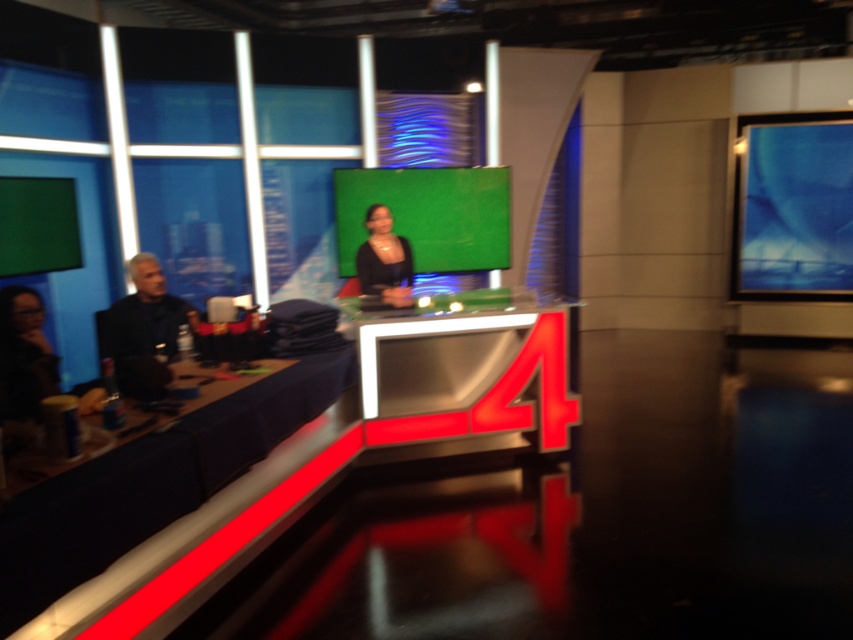
Question: Considering the relative positions of metallic reflective table at center and green matte screen at center in the image provided, where is metallic reflective table at center located with respect to green matte screen at center?

Choices:
 (A) right
 (B) left

Answer: (A)

Question: Is dark blue shirt at left further to camera compared to black glossy dress at center?

Choices:
 (A) no
 (B) yes

Answer: (A)

Question: Which of the following is the closest to the observer?

Choices:
 (A) green matte screen at center
 (B) metallic table at left
 (C) metallic reflective table at center

Answer: (B)

Question: Where is matte blue screen at upper right located in relation to green matte screen at center in the image?

Choices:
 (A) below
 (B) above

Answer: (B)

Question: Which point is closer to the camera?

Choices:
 (A) green matte screen at center
 (B) metallic reflective table at center
 (C) matte blue screen at upper right
 (D) metallic table at left

Answer: (D)

Question: Which point is farther to the camera?

Choices:
 (A) matte blue screen at upper right
 (B) dark blue shirt at left
 (C) metallic table at left

Answer: (A)